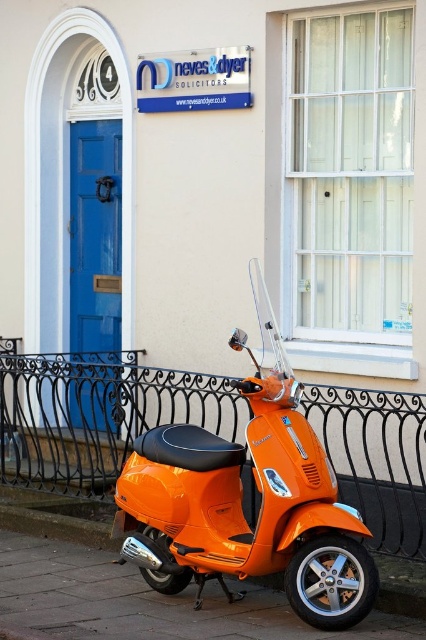
How far apart are orange glossy scooter at center and black wrought iron fence at lower center?

orange glossy scooter at center and black wrought iron fence at lower center are 4.70 feet apart.

Measure the distance between orange glossy scooter at center and camera.

orange glossy scooter at center is 4.72 meters away from camera.

At what (x,y) coordinates should I click in order to perform the action: click on orange glossy scooter at center. Please return your answer as a coordinate pair (x, y). The height and width of the screenshot is (640, 426). Looking at the image, I should click on (241, 499).

You are a GUI agent. You are given a task and a screenshot of the screen. Output one action in this format:
    pyautogui.click(x=<x>, y=<y>)
    Task: Click on the orange glossy scooter at center
    
    Given the screenshot: What is the action you would take?
    coord(241,499)

Describe the element at coordinates (241, 499) in the screenshot. I see `orange glossy scooter at center` at that location.

Does point (250, 561) come farther from viewer compared to point (106, 221)?

No, it is in front of (106, 221).

You are a GUI agent. You are given a task and a screenshot of the screen. Output one action in this format:
    pyautogui.click(x=<x>, y=<y>)
    Task: Click on the orange glossy scooter at center
    
    Given the screenshot: What is the action you would take?
    pyautogui.click(x=241, y=499)

Which is more to the right, orange glossy scooter at center or orange matte scooter at lower center?

From the viewer's perspective, orange glossy scooter at center appears more on the right side.

From the picture: Which is above, orange glossy scooter at center or orange matte scooter at lower center?

orange glossy scooter at center is above.

Does point (324, 461) come in front of point (123, 568)?

Yes, it is in front of point (123, 568).

Identify the location of orange glossy scooter at center. [x=241, y=499].